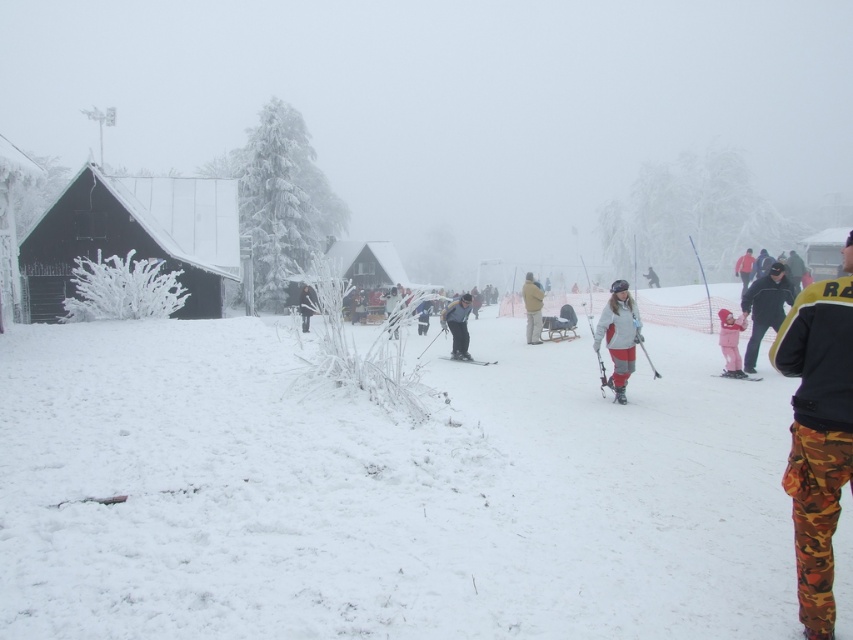
Question: Which point is closer to the camera taking this photo?

Choices:
 (A) [741, 284]
 (B) [824, 333]

Answer: (B)

Question: Does camouflage pants at center appear on the left side of matte black ski at center?

Choices:
 (A) yes
 (B) no

Answer: (B)

Question: Which point is closer to the camera?

Choices:
 (A) camo pants at right
 (B) dark gray snowsuit at center
 (C) white matte ski at lower right
 (D) camouflage pants at center

Answer: (A)

Question: Can you confirm if matte gray jacket at center is smaller than tan fabric coat at center?

Choices:
 (A) no
 (B) yes

Answer: (B)

Question: Is white fluffy snow at center positioned at the back of pink fabric snowsuit at center?

Choices:
 (A) no
 (B) yes

Answer: (A)

Question: Which of the following is the closest to the observer?

Choices:
 (A) black matte jacket at right
 (B) white matte ski at lower right

Answer: (A)